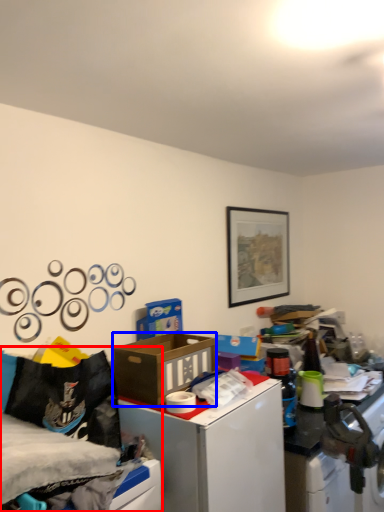
Question: Which object is closer to the camera taking this photo, bed (highlighted by a red box) or box (highlighted by a blue box)?

Choices:
 (A) bed
 (B) box

Answer: (A)